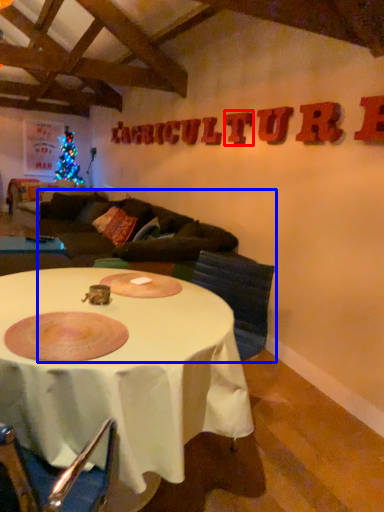
Question: Among these objects, which one is nearest to the camera, letter (highlighted by a red box) or couch (highlighted by a blue box)?

Choices:
 (A) letter
 (B) couch

Answer: (B)